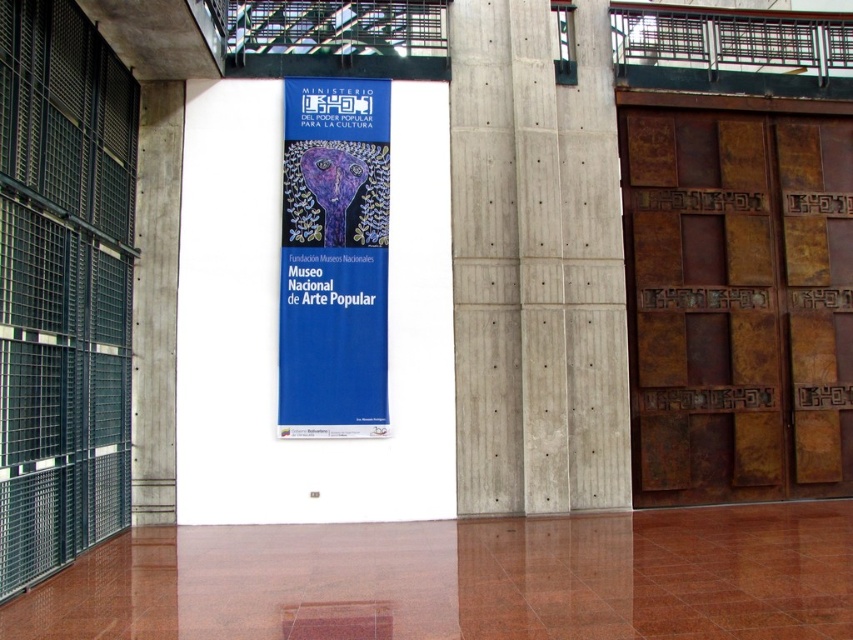
Question: Which point is farther to the camera?

Choices:
 (A) (747, 348)
 (B) (505, 481)
 (C) (349, 257)

Answer: (A)

Question: Is rusty metal door at right in front of concrete at center?

Choices:
 (A) yes
 (B) no

Answer: (B)

Question: Is rusty metal door at right to the left of blue matte poster at center from the viewer's perspective?

Choices:
 (A) yes
 (B) no

Answer: (B)

Question: Which object is farther from the camera taking this photo?

Choices:
 (A) blue matte poster at center
 (B) rusty metal door at right
 (C) concrete at center

Answer: (B)

Question: Is concrete at center to the left of blue matte poster at center from the viewer's perspective?

Choices:
 (A) yes
 (B) no

Answer: (B)

Question: Estimate the real-world distances between objects in this image. Which object is closer to the concrete at center?

Choices:
 (A) blue matte poster at center
 (B) rusty metal door at right

Answer: (B)